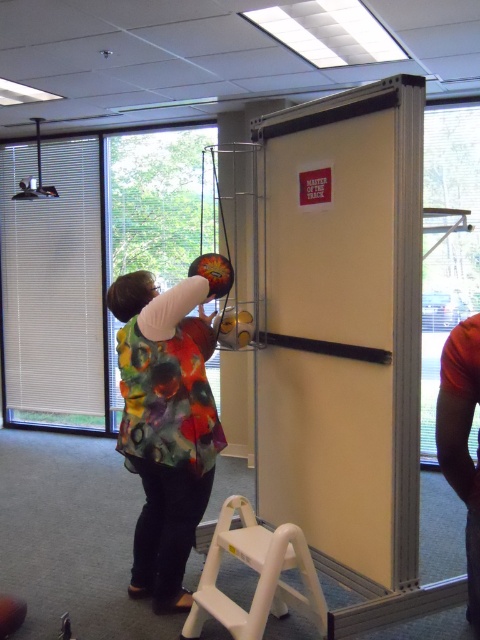
Question: Does transparent glass door at center have a smaller size compared to white plastic stool at lower center?

Choices:
 (A) yes
 (B) no

Answer: (B)

Question: Is white matte screen door at center positioned behind white plastic stool at lower center?

Choices:
 (A) no
 (B) yes

Answer: (B)

Question: Among these objects, which one is nearest to the camera?

Choices:
 (A) transparent glass door at center
 (B) white matte screen door at center
 (C) multicolored fabric vest at center
 (D) white plastic stool at lower center

Answer: (D)

Question: Among these objects, which one is nearest to the camera?

Choices:
 (A) multicolored fabric vest at center
 (B) white plastic stool at lower center
 (C) white matte screen door at center

Answer: (B)

Question: Which point is farther to the camera?

Choices:
 (A) (276, 561)
 (B) (76, 205)
 (C) (197, 412)

Answer: (B)

Question: Is white matte screen door at center further to the viewer compared to white plastic stool at lower center?

Choices:
 (A) yes
 (B) no

Answer: (A)